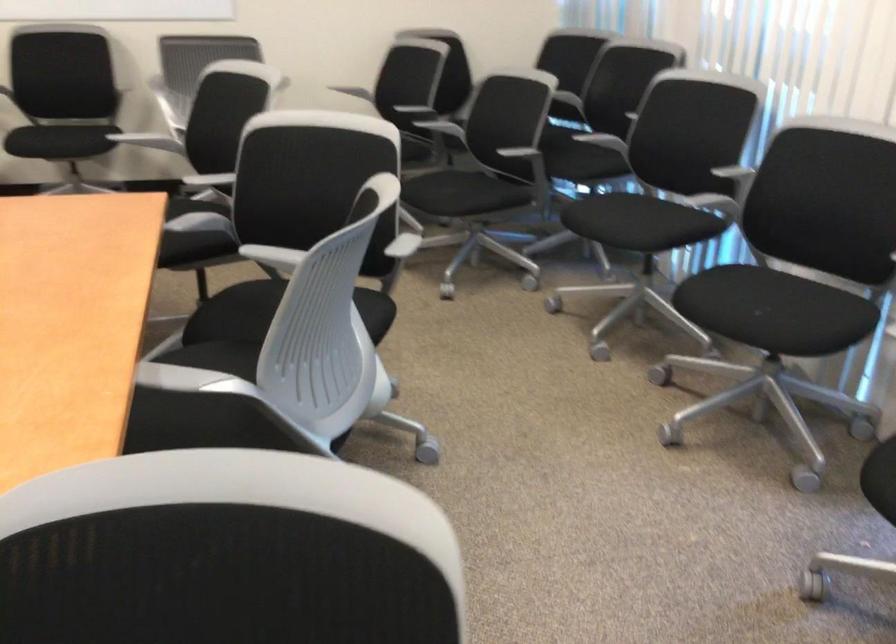
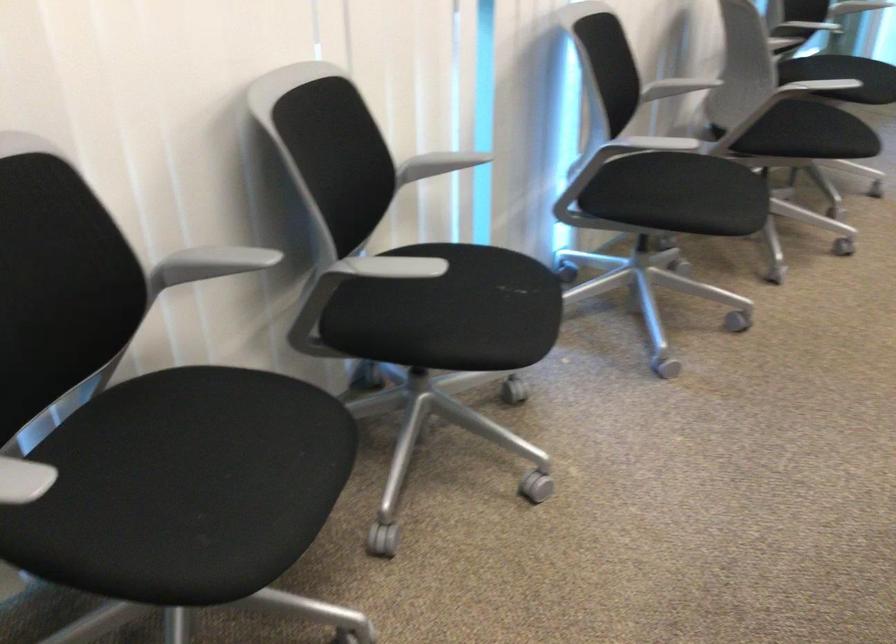
Find the pixel in the second image that matches (722,167) in the first image.

(211, 263)